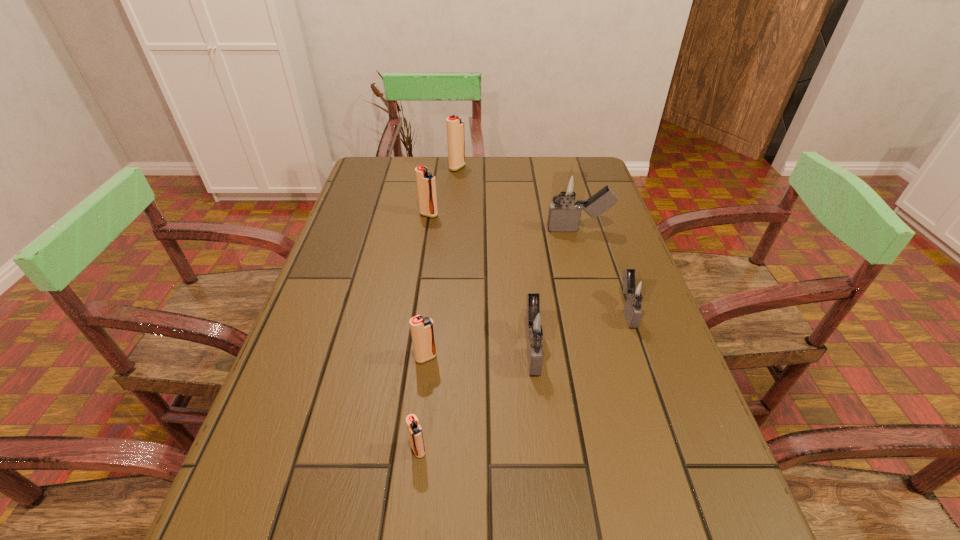
The width and height of the screenshot is (960, 540). In order to click on the farthest igniter in this screenshot , I will do `click(455, 127)`.

What are the coordinates of `the biggest red igniter` in the screenshot? It's located at (455, 127).

This screenshot has width=960, height=540. Identify the location of the biggest gray igniter. (564, 214).

In order to click on the farthest gray igniter in this screenshot , I will do `click(564, 214)`.

Locate an element on the screen. This screenshot has height=540, width=960. the third smallest red igniter is located at coordinates (426, 186).

In order to click on the second farthest object in this screenshot , I will do `click(426, 186)`.

Where is `the third object from right to left`? the third object from right to left is located at coordinates click(536, 325).

Where is `the second smallest gray igniter`? The height and width of the screenshot is (540, 960). the second smallest gray igniter is located at coordinates (536, 325).

This screenshot has width=960, height=540. I want to click on the smallest gray igniter, so click(x=636, y=290).

Where is `the third farthest red igniter`? the third farthest red igniter is located at coordinates (422, 329).